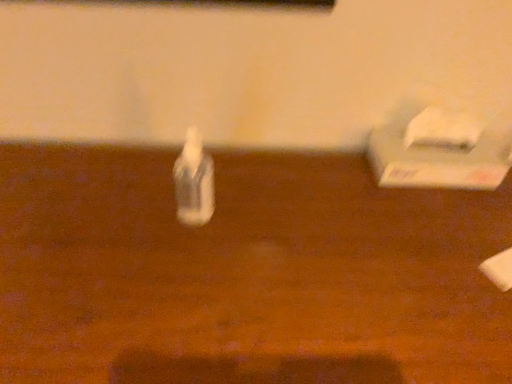
Locate an element on the screen. free spot behind transparent plastic bottle at center is located at coordinates (200, 171).